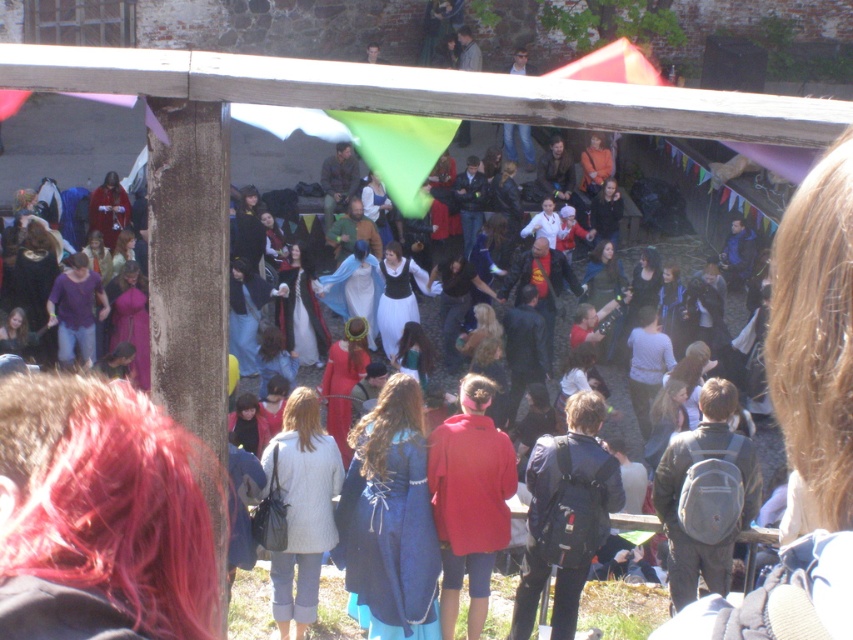
Looking at this image, you are at the festival and want to wear one of the two coats you see. The matte red hoodie at center and the dark blue fabric coat at center are both available. If you want to choose the wider one, which should you pick?

The dark blue fabric coat at center is wider than the matte red hoodie at center, so you should pick the dark blue fabric coat at center.

You are at the festival and see two people wearing the matte red hoodie at center and the dark blue fabric coat at center. Which person is standing to the left of the other?

The matte red hoodie at center is positioned on the left side of dark blue fabric coat at center, so the person wearing the matte red hoodie at center is standing to the left of the person in the dark blue fabric coat at center.